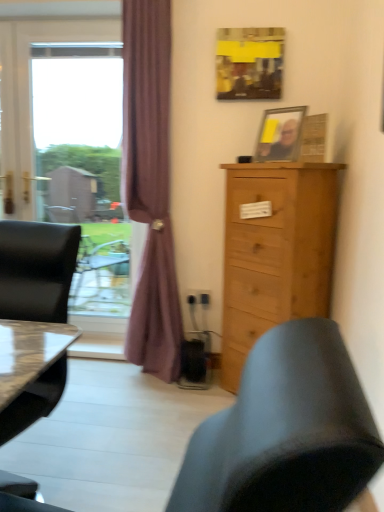
Question: From a real-world perspective, is purple fabric curtain at left positioned under transparent glass window at left based on gravity?

Choices:
 (A) no
 (B) yes

Answer: (A)

Question: Considering the relative sizes of purple fabric curtain at left and transparent glass window at left in the image provided, is purple fabric curtain at left bigger than transparent glass window at left?

Choices:
 (A) yes
 (B) no

Answer: (A)

Question: Is transparent glass window at left inside purple fabric curtain at left?

Choices:
 (A) yes
 (B) no

Answer: (B)

Question: Considering the relative positions of purple fabric curtain at left and transparent glass window at left in the image provided, is purple fabric curtain at left behind transparent glass window at left?

Choices:
 (A) yes
 (B) no

Answer: (B)

Question: Can you confirm if purple fabric curtain at left is positioned to the left of transparent glass window at left?

Choices:
 (A) yes
 (B) no

Answer: (B)

Question: Is natural wood cabinet at right in front of or behind purple fabric curtain at left in the image?

Choices:
 (A) behind
 (B) front

Answer: (B)

Question: Do you think natural wood cabinet at right is within purple fabric curtain at left, or outside of it?

Choices:
 (A) outside
 (B) inside

Answer: (A)

Question: Based on their sizes in the image, would you say natural wood cabinet at right is bigger or smaller than purple fabric curtain at left?

Choices:
 (A) big
 (B) small

Answer: (A)

Question: Is point (311, 315) positioned closer to the camera than point (147, 316)?

Choices:
 (A) closer
 (B) farther

Answer: (A)

Question: From the image's perspective, is matte black chair at left above or below transparent glass window at left?

Choices:
 (A) below
 (B) above

Answer: (A)

Question: Is point 51,376 positioned closer to the camera than point 56,80?

Choices:
 (A) farther
 (B) closer

Answer: (B)

Question: Considering the positions of matte black chair at left and transparent glass window at left in the image, is matte black chair at left wider or thinner than transparent glass window at left?

Choices:
 (A) wide
 (B) thin

Answer: (A)

Question: In terms of height, does matte black chair at left look taller or shorter compared to transparent glass window at left?

Choices:
 (A) tall
 (B) short

Answer: (B)

Question: Is yellow paper at upper center, the 2th picture frame positioned from the bottom, inside or outside of wooden picture frame at upper right, which ranks as the second picture frame in top-to-bottom order?

Choices:
 (A) outside
 (B) inside

Answer: (A)

Question: From a real-world perspective, relative to wooden picture frame at upper right, which ranks as the second picture frame in top-to-bottom order, is yellow paper at upper center, the 2th picture frame positioned from the bottom, vertically above or below?

Choices:
 (A) above
 (B) below

Answer: (A)